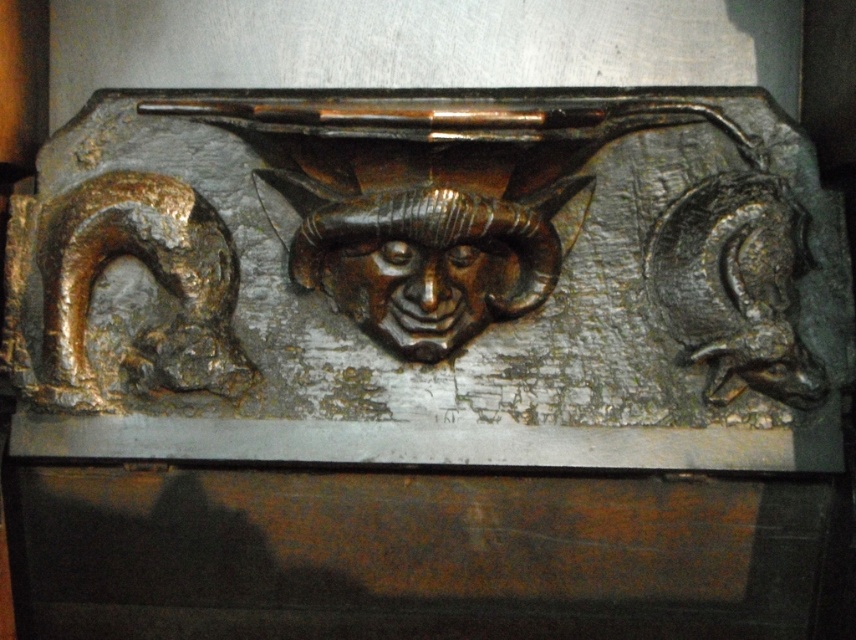
Which is in front, point (824, 262) or point (418, 262)?

Positioned in front is point (418, 262).

Which is more to the left, bronze textured mask at center or shiny bronze mask at center?

shiny bronze mask at center is more to the left.

Does point (605, 358) come behind point (379, 253)?

Yes, it is behind point (379, 253).

What are the coordinates of `bronze textured mask at center` in the screenshot? It's located at (431, 259).

Does bronze textured face at center appear over shiny bronze mask at center?

Yes.

Who is shorter, bronze textured face at center or shiny bronze mask at center?

Standing shorter between the two is shiny bronze mask at center.

Where is `bronze textured face at center`? This screenshot has width=856, height=640. bronze textured face at center is located at coordinates (426, 264).

Between bronze textured mask at center and bronze textured face at center, which one has more height?

Standing taller between the two is bronze textured mask at center.

Who is positioned more to the left, bronze textured mask at center or bronze textured face at center?

bronze textured mask at center

Where is `bronze textured mask at center`? The width and height of the screenshot is (856, 640). bronze textured mask at center is located at coordinates (431, 259).